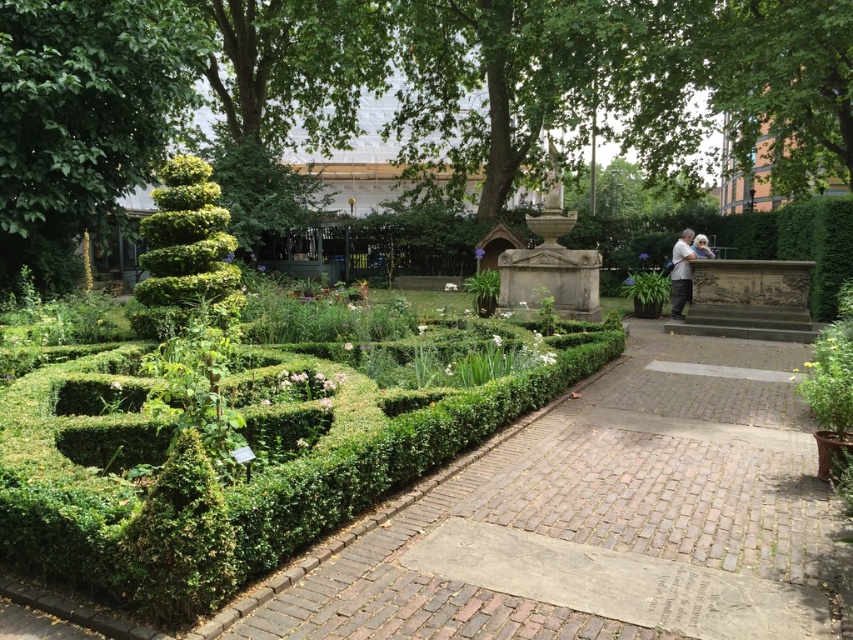
From the picture: Is green leafy bush at left above light brown leather jacket at right?

No.

Which of these two, green leafy bush at left or light brown leather jacket at right, stands shorter?

With less height is light brown leather jacket at right.

Describe the element at coordinates (184, 252) in the screenshot. Image resolution: width=853 pixels, height=640 pixels. I see `green leafy bush at left` at that location.

Where is `green leafy bush at left`? Image resolution: width=853 pixels, height=640 pixels. green leafy bush at left is located at coordinates (184, 252).

Is point (668, 400) positioned in front of point (209, 540)?

That is False.

Between brick paved path at center and green textured bush at lower left, which one has more height?

Standing taller between the two is green textured bush at lower left.

Does point (851, 634) lie behind point (200, 529)?

No, (851, 634) is in front of (200, 529).

You are a GUI agent. You are given a task and a screenshot of the screen. Output one action in this format:
    pyautogui.click(x=<x>, y=<y>)
    Task: Click on the brick paved path at center
    
    Given the screenshot: What is the action you would take?
    pyautogui.click(x=606, y=520)

Between green leafy tree at center and green textured bush at lower left, which one has more height?

green leafy tree at center is taller.

Does green leafy tree at center have a smaller size compared to green textured bush at lower left?

No, green leafy tree at center is not smaller than green textured bush at lower left.

Is point (209, 52) closer to camera compared to point (215, 534)?

No, (209, 52) is further to viewer.

I want to click on green leafy tree at center, so click(408, 84).